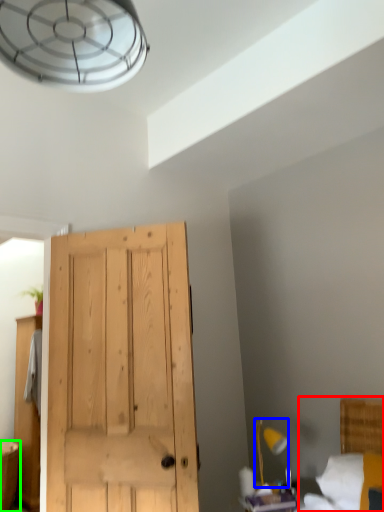
Question: Which object is the farthest from bed (highlighted by a red box)? Choose among these: light fixture (highlighted by a blue box) or vanity (highlighted by a green box).

Choices:
 (A) light fixture
 (B) vanity

Answer: (B)